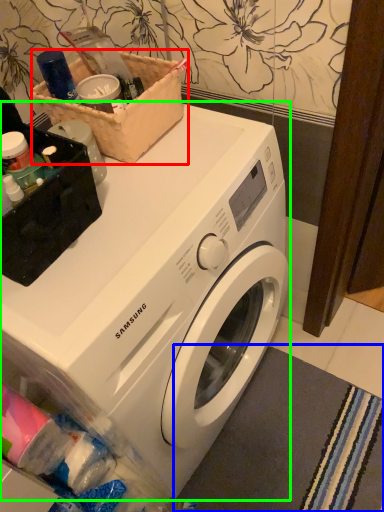
Question: Which object is the farthest from basket (highlighted by a red box)? Choose among these: bath mat (highlighted by a blue box) or washing machine (highlighted by a green box).

Choices:
 (A) bath mat
 (B) washing machine

Answer: (A)